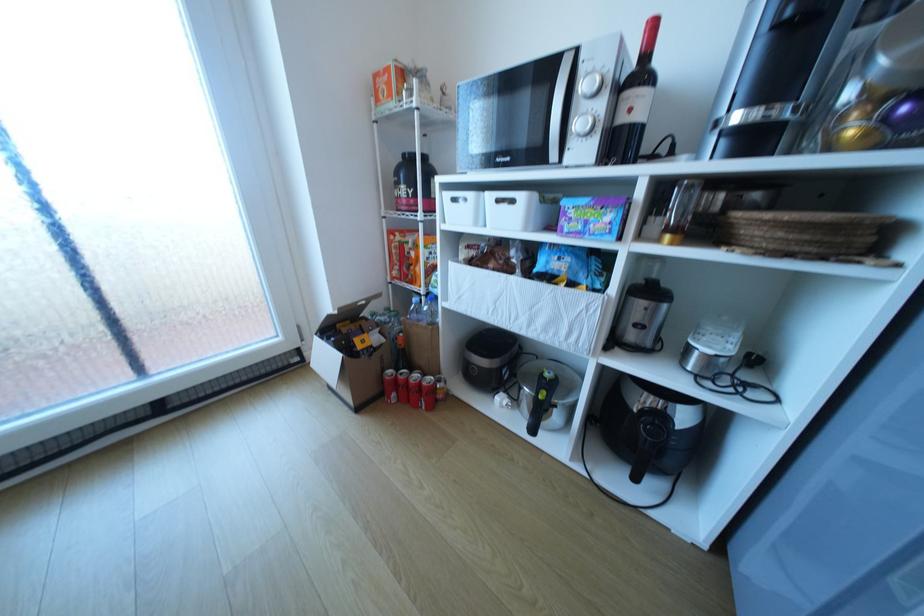
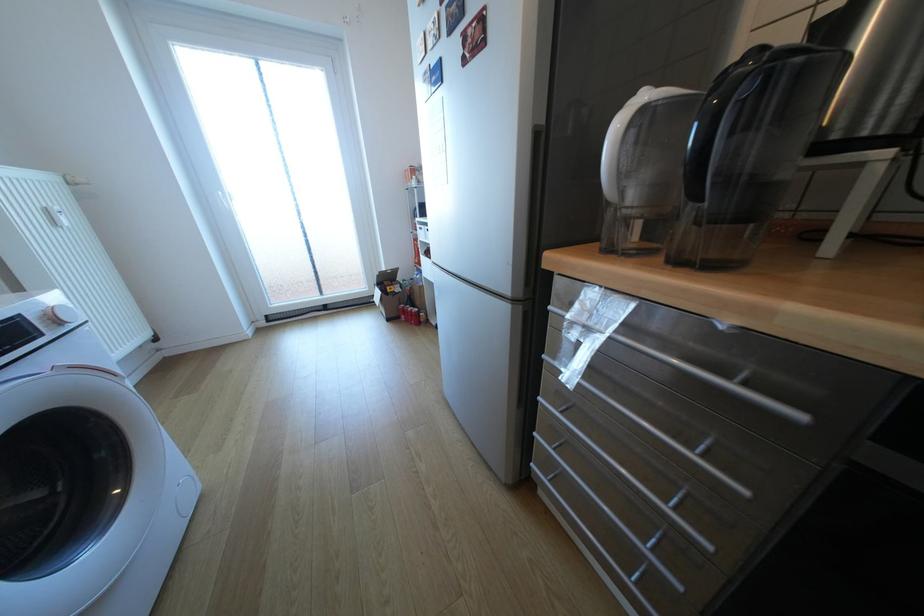
The point at (366, 339) is marked in the first image. Where is the corresponding point in the second image?

(397, 288)